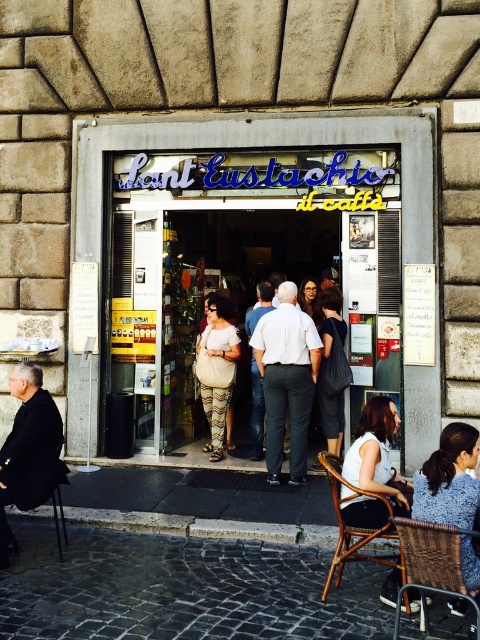
Between point (425, 570) and point (204, 348), which one is positioned behind?

The point (204, 348) is more distant.

Who is more distant from viewer, (444, 548) or (228, 348)?

Point (228, 348)

Where is `woven brown chair at lower right`? woven brown chair at lower right is located at coordinates (432, 564).

Looking at this image, measure the distance from metallic black chair at lower left to beige textured bag at center.

3.00 meters

Between metallic black chair at lower left and beige textured bag at center, which one has less height?

metallic black chair at lower left is shorter.

Who is more forward, (x=36, y=490) or (x=226, y=339)?

Point (x=36, y=490)

Locate an element on the screen. metallic black chair at lower left is located at coordinates click(x=29, y=490).

Between metallic black chair at lower left and white cotton shirt at center, which one has less height?

Standing shorter between the two is metallic black chair at lower left.

What do you see at coordinates (29, 490) in the screenshot? I see `metallic black chair at lower left` at bounding box center [29, 490].

Who is more forward, (36,481) or (261,282)?

Point (36,481) is more forward.

I want to click on metallic black chair at lower left, so click(29, 490).